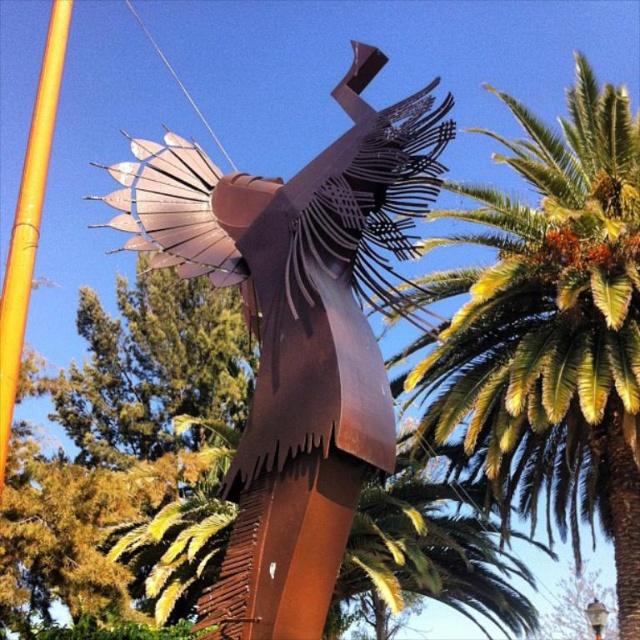
Between rusty metal sculpture at center and green leafy palm tree at upper right, which one is positioned higher?

Positioned higher is rusty metal sculpture at center.

Is rusty metal sculpture at center below green leafy palm tree at upper right?

Incorrect, rusty metal sculpture at center is not positioned below green leafy palm tree at upper right.

Image resolution: width=640 pixels, height=640 pixels. In order to click on rusty metal sculpture at center in this screenshot , I will do `click(296, 332)`.

Who is higher up, rusty metal sculpture at center or orange bamboo pole at left?

orange bamboo pole at left is higher up.

Does rusty metal sculpture at center appear on the left side of orange bamboo pole at left?

In fact, rusty metal sculpture at center is to the right of orange bamboo pole at left.

Is point (253, 253) more distant than point (54, 33)?

No, it is in front of (54, 33).

Locate an element on the screen. This screenshot has width=640, height=640. rusty metal sculpture at center is located at coordinates (296, 332).

Who is higher up, green leafy palm tree at upper right or orange bamboo pole at left?

orange bamboo pole at left is higher up.

Does green leafy palm tree at upper right have a greater height compared to orange bamboo pole at left?

Correct, green leafy palm tree at upper right is much taller as orange bamboo pole at left.

Which is behind, point (432, 428) or point (13, 262)?

The point (432, 428) is behind.

Where is `green leafy palm tree at upper right`? This screenshot has height=640, width=640. green leafy palm tree at upper right is located at coordinates (552, 330).